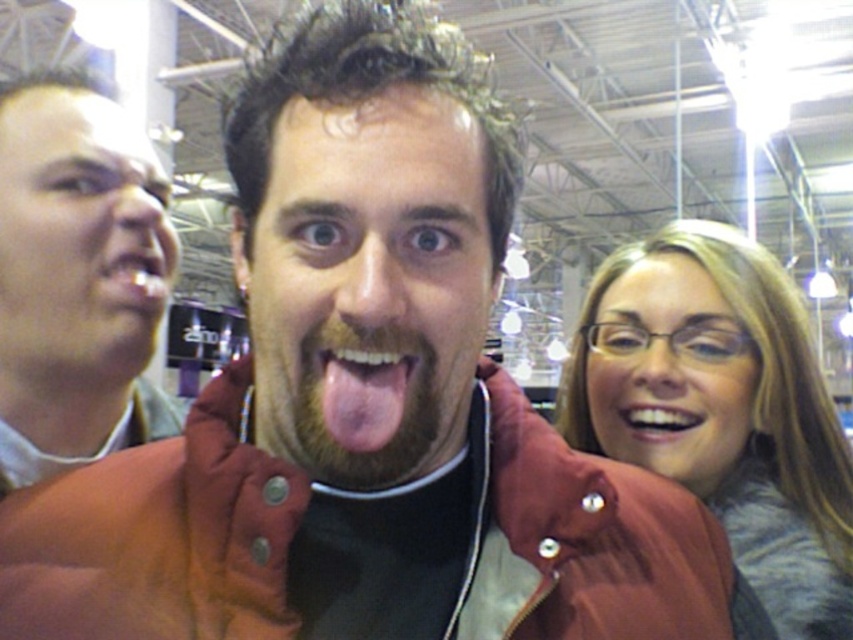
Question: Estimate the real-world distances between objects in this image. Which object is farther from the pink flesh-colored tongue at center?

Choices:
 (A) matte gray sweater at right
 (B) white glossy teeth at center

Answer: (A)

Question: Which object is positioned farthest from the pink flesh-colored tongue at center?

Choices:
 (A) white glossy teeth at center
 (B) matte gray sweater at right

Answer: (B)

Question: Is pink flesh-colored tongue at center further to the viewer compared to white glossy teeth at center?

Choices:
 (A) yes
 (B) no

Answer: (B)

Question: Which of the following is the farthest from the observer?

Choices:
 (A) (738, 346)
 (B) (363, 451)

Answer: (A)

Question: Observing the image, what is the correct spatial positioning of matte gray sweater at right in reference to white glossy teeth at center?

Choices:
 (A) left
 (B) right

Answer: (B)

Question: Can you confirm if matte gray sweater at right is positioned above white glossy teeth at center?

Choices:
 (A) yes
 (B) no

Answer: (A)